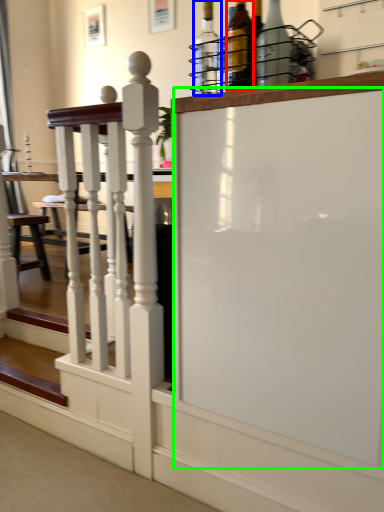
Question: Which object is positioned closest to bottle (highlighted by a red box)? Select from bottle (highlighted by a blue box) and screen door (highlighted by a green box).

Choices:
 (A) bottle
 (B) screen door

Answer: (A)